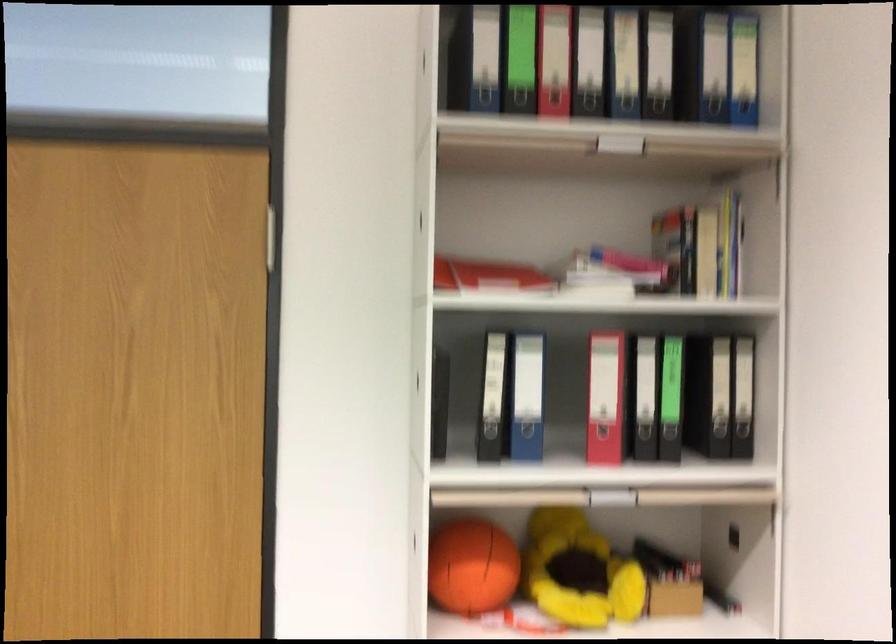
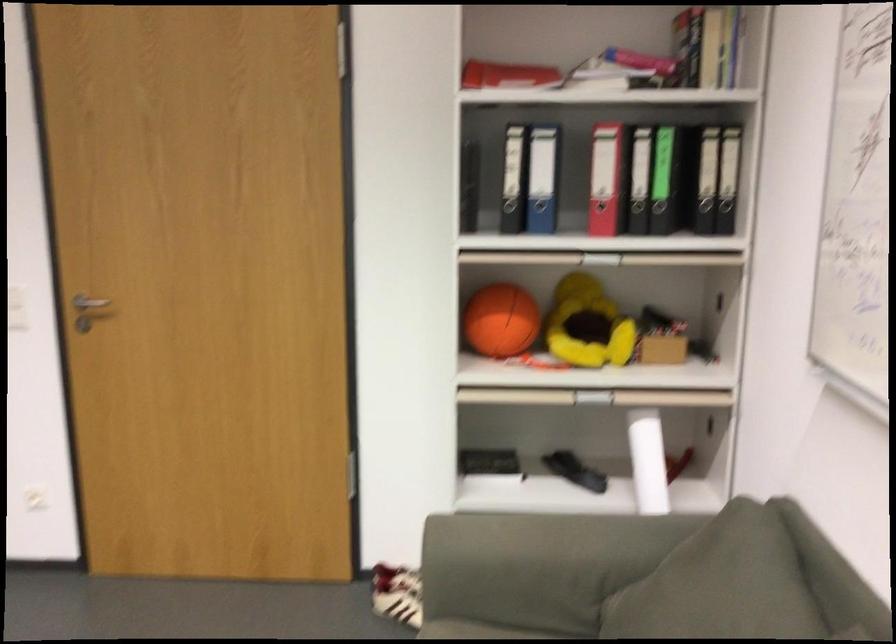
Where in the second image is the point corresponding to point 528,442 from the first image?

(539, 216)